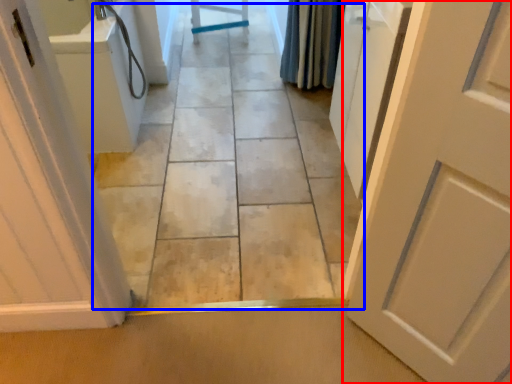
Question: Which of the following is the farthest to the observer, door (highlighted by a red box) or path (highlighted by a blue box)?

Choices:
 (A) door
 (B) path

Answer: (B)